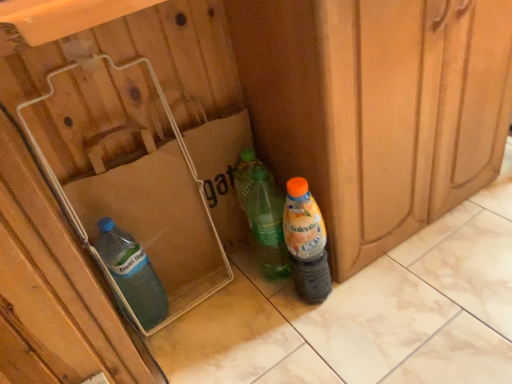
What do you see at coordinates (147, 209) in the screenshot? The width and height of the screenshot is (512, 384). I see `translucent plastic box at lower left` at bounding box center [147, 209].

Consider the image. In order to face translucent plastic box at lower left, should I rotate leftwards or rightwards?

A 11.661 degree turn to the left will do.

Measure the distance between point (116, 256) and camera.

Point (116, 256) and camera are 35.98 inches apart from each other.

Identify the location of translucent plastic bottle at lower right, the second bottle positioned from the left. (306, 242).

Where is `translucent plastic box at lower left`? translucent plastic box at lower left is located at coordinates (147, 209).

Is transparent plastic bottle at lower left, which appears as the second bottle when viewed from the right, wider than translucent plastic bottle at lower right, the 1th bottle in the right-to-left sequence?

Yes, transparent plastic bottle at lower left, which appears as the second bottle when viewed from the right, is wider than translucent plastic bottle at lower right, the 1th bottle in the right-to-left sequence.

Is transparent plastic bottle at lower left, the 1th bottle positioned from the left, in contact with translucent plastic bottle at lower right, the 1th bottle in the right-to-left sequence?

No.

Measure the distance from transparent plastic bottle at lower left, which appears as the second bottle when viewed from the right, to translucent plastic bottle at lower right, the 1th bottle in the right-to-left sequence.

transparent plastic bottle at lower left, which appears as the second bottle when viewed from the right, is 13.79 inches from translucent plastic bottle at lower right, the 1th bottle in the right-to-left sequence.

Considering the sizes of objects transparent plastic bottle at lower left, the 1th bottle positioned from the left, and translucent plastic bottle at lower right, the second bottle positioned from the left, in the image provided, who is shorter, transparent plastic bottle at lower left, the 1th bottle positioned from the left, or translucent plastic bottle at lower right, the second bottle positioned from the left,?

transparent plastic bottle at lower left, the 1th bottle positioned from the left.

Based on the photo, is translucent plastic box at lower left positioned in front of transparent plastic bottle at lower left, the 1th bottle positioned from the left?

Yes, translucent plastic box at lower left is closer to the camera.

Is translucent plastic box at lower left positioned with its back to transparent plastic bottle at lower left, the 1th bottle positioned from the left?

Yes, translucent plastic box at lower left's orientation is away from transparent plastic bottle at lower left, the 1th bottle positioned from the left.

Does point (165, 218) come farther from viewer compared to point (136, 254)?

Yes, point (165, 218) is farther from viewer.

Considering the relative sizes of translucent plastic box at lower left and transparent plastic bottle at lower left, which appears as the second bottle when viewed from the right, in the image provided, is translucent plastic box at lower left taller than transparent plastic bottle at lower left, which appears as the second bottle when viewed from the right,?

Indeed, translucent plastic box at lower left has a greater height compared to transparent plastic bottle at lower left, which appears as the second bottle when viewed from the right.

Identify the location of the 1st bottle below the translucent plastic box at lower left (from a real-world perspective). This screenshot has width=512, height=384. (306, 242).

Between translucent plastic bottle at lower right, the 1th bottle in the right-to-left sequence, and translucent plastic box at lower left, which one appears on the right side from the viewer's perspective?

Positioned to the right is translucent plastic bottle at lower right, the 1th bottle in the right-to-left sequence.

Does translucent plastic bottle at lower right, the 1th bottle in the right-to-left sequence, have a larger size compared to translucent plastic box at lower left?

Incorrect, translucent plastic bottle at lower right, the 1th bottle in the right-to-left sequence, is not larger than translucent plastic box at lower left.

From a real-world perspective, is translucent plastic bottle at lower right, the second bottle positioned from the left, physically located above or below translucent plastic box at lower left?

Clearly, from a real-world perspective, translucent plastic bottle at lower right, the second bottle positioned from the left, is below translucent plastic box at lower left.

Who is bigger, transparent plastic bottle at lower left, which appears as the second bottle when viewed from the right, or translucent plastic box at lower left?

Bigger between the two is translucent plastic box at lower left.

Based on the photo, from the image's perspective, is transparent plastic bottle at lower left, which appears as the second bottle when viewed from the right, located above or below translucent plastic box at lower left?

transparent plastic bottle at lower left, which appears as the second bottle when viewed from the right, is below translucent plastic box at lower left.

Measure the distance from transparent plastic bottle at lower left, the 1th bottle positioned from the left, to translucent plastic box at lower left.

transparent plastic bottle at lower left, the 1th bottle positioned from the left, and translucent plastic box at lower left are 4.17 inches apart from each other.

Which is in front, transparent plastic bottle at lower left, which appears as the second bottle when viewed from the right, or translucent plastic box at lower left?

translucent plastic box at lower left is more forward.

From the image's perspective, does translucent plastic box at lower left appear lower than translucent plastic bottle at lower right, the second bottle positioned from the left?

Indeed, from the image's perspective, translucent plastic box at lower left is shown beneath translucent plastic bottle at lower right, the second bottle positioned from the left.

Between point (140, 183) and point (308, 295), which one is positioned in front?

The point (140, 183) is in front.

Considering the sizes of objects translucent plastic box at lower left and translucent plastic bottle at lower right, the 1th bottle in the right-to-left sequence, in the image provided, who is shorter, translucent plastic box at lower left or translucent plastic bottle at lower right, the 1th bottle in the right-to-left sequence,?

translucent plastic bottle at lower right, the 1th bottle in the right-to-left sequence.

From a real-world perspective, which object rests below the other?

From a 3D spatial view, translucent plastic bottle at lower right, the 1th bottle in the right-to-left sequence, is below.

Considering the sizes of objects translucent plastic bottle at lower right, the second bottle positioned from the left, and transparent plastic bottle at lower left, the 1th bottle positioned from the left, in the image provided, who is smaller, translucent plastic bottle at lower right, the second bottle positioned from the left, or transparent plastic bottle at lower left, the 1th bottle positioned from the left,?

Smaller between the two is transparent plastic bottle at lower left, the 1th bottle positioned from the left.

In order to click on bottle located below the translucent plastic bottle at lower right, the 1th bottle in the right-to-left sequence (from the image's perspective) in this screenshot , I will do `click(132, 273)`.

Based on the photo, from a real-world perspective, who is located higher, translucent plastic bottle at lower right, the 1th bottle in the right-to-left sequence, or transparent plastic bottle at lower left, the 1th bottle positioned from the left?

translucent plastic bottle at lower right, the 1th bottle in the right-to-left sequence.

Is translucent plastic bottle at lower right, the second bottle positioned from the left, situated inside transparent plastic bottle at lower left, which appears as the second bottle when viewed from the right, or outside?

translucent plastic bottle at lower right, the second bottle positioned from the left, is not inside transparent plastic bottle at lower left, which appears as the second bottle when viewed from the right, it's outside.

Where is `bottle on the left of translucent plastic bottle at lower right, the second bottle positioned from the left`? This screenshot has height=384, width=512. bottle on the left of translucent plastic bottle at lower right, the second bottle positioned from the left is located at coordinates (x=132, y=273).

Find the location of `cardboard box that appears in front of the transparent plastic bottle at lower left, the 1th bottle positioned from the left`. cardboard box that appears in front of the transparent plastic bottle at lower left, the 1th bottle positioned from the left is located at coordinates (147, 209).

Estimate the real-world distances between objects in this image. Which object is further from translucent plastic box at lower left, translucent plastic bottle at lower right, the second bottle positioned from the left, or transparent plastic bottle at lower left, the 1th bottle positioned from the left?

translucent plastic bottle at lower right, the second bottle positioned from the left, is positioned further to the anchor translucent plastic box at lower left.

Which object lies nearer to the anchor point translucent plastic box at lower left, transparent plastic bottle at lower left, the 1th bottle positioned from the left, or translucent plastic bottle at lower right, the second bottle positioned from the left?

The object closer to translucent plastic box at lower left is transparent plastic bottle at lower left, the 1th bottle positioned from the left.

Estimate the real-world distances between objects in this image. Which object is closer to translucent plastic bottle at lower right, the 1th bottle in the right-to-left sequence, translucent plastic box at lower left or transparent plastic bottle at lower left, the 1th bottle positioned from the left?

Among the two, translucent plastic box at lower left is located nearer to translucent plastic bottle at lower right, the 1th bottle in the right-to-left sequence.

Estimate the real-world distances between objects in this image. Which object is closer to translucent plastic bottle at lower right, the second bottle positioned from the left, transparent plastic bottle at lower left, which appears as the second bottle when viewed from the right, or translucent plastic box at lower left?

translucent plastic box at lower left.

From the image, which object appears to be nearer to transparent plastic bottle at lower left, which appears as the second bottle when viewed from the right, translucent plastic box at lower left or translucent plastic bottle at lower right, the 1th bottle in the right-to-left sequence?

The object closer to transparent plastic bottle at lower left, which appears as the second bottle when viewed from the right, is translucent plastic box at lower left.

When comparing their distances from transparent plastic bottle at lower left, which appears as the second bottle when viewed from the right, does translucent plastic bottle at lower right, the second bottle positioned from the left, or translucent plastic box at lower left seem closer?

The object closer to transparent plastic bottle at lower left, which appears as the second bottle when viewed from the right, is translucent plastic box at lower left.

At what (x,y) coordinates should I click in order to perform the action: click on cardboard box situated between transparent plastic bottle at lower left, which appears as the second bottle when viewed from the right, and translucent plastic bottle at lower right, the 1th bottle in the right-to-left sequence, from left to right. Please return your answer as a coordinate pair (x, y). The image size is (512, 384). Looking at the image, I should click on (147, 209).